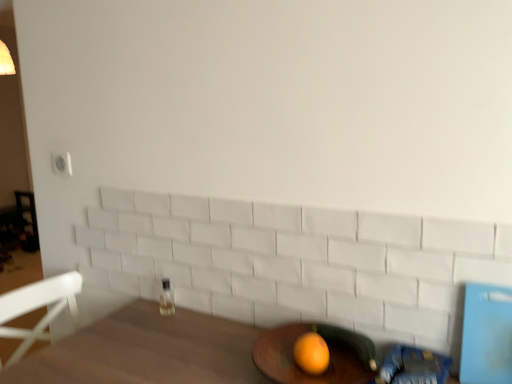
Question: Is orange matte at lower center spatially inside wooden round table at lower center, or outside of it?

Choices:
 (A) outside
 (B) inside

Answer: (B)

Question: Relative to wooden round table at lower center, is orange matte at lower center in front or behind?

Choices:
 (A) behind
 (B) front

Answer: (A)

Question: Estimate the real-world distances between objects in this image. Which object is closer to the clear glass bottle at center?

Choices:
 (A) orange matte at lower center
 (B) wooden round table at lower center

Answer: (B)

Question: Based on their relative distances, which object is nearer to the orange matte at lower center?

Choices:
 (A) clear glass bottle at center
 (B) wooden round table at lower center

Answer: (B)